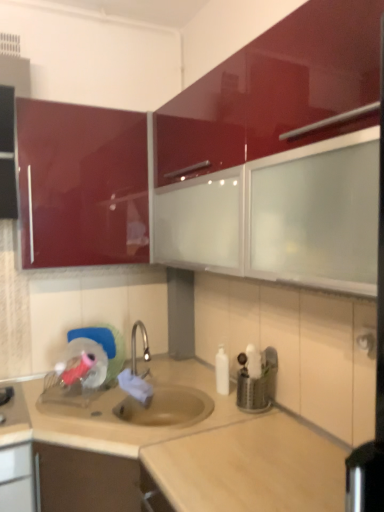
At what (x,y) coordinates should I click in order to perform the action: click on free space above beige laminate countertop at center (from a real-world perspective). Please return your answer as a coordinate pair (x, y). This screenshot has width=384, height=512. Looking at the image, I should click on (186, 429).